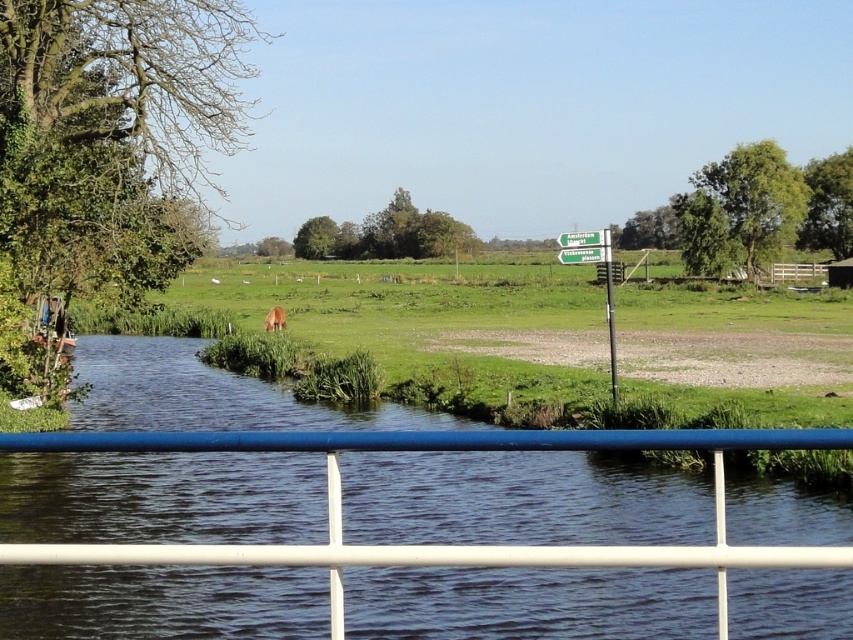
Question: Does green plastic signpost at center have a lesser width compared to green plastic sign at upper center?

Choices:
 (A) yes
 (B) no

Answer: (B)

Question: Is green plastic sign at upper center smaller than brown furry dog at center?

Choices:
 (A) yes
 (B) no

Answer: (A)

Question: Which object appears closest to the camera in this image?

Choices:
 (A) green plastic sign at upper center
 (B) green plastic signpost at center

Answer: (B)

Question: Based on their relative distances, which object is farther from the brown furry dog at center?

Choices:
 (A) green plastic sign at center
 (B) green plastic sign at upper center

Answer: (A)

Question: Is green plastic sign at center behind brown furry dog at center?

Choices:
 (A) yes
 (B) no

Answer: (B)

Question: Which object is farther from the camera taking this photo?

Choices:
 (A) green plastic signpost at center
 (B) green plastic sign at upper center

Answer: (B)